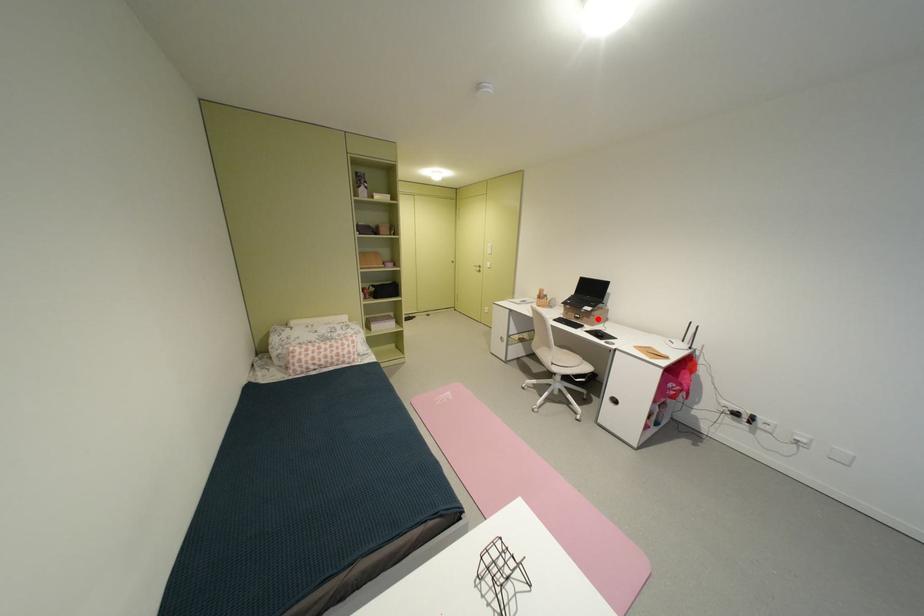
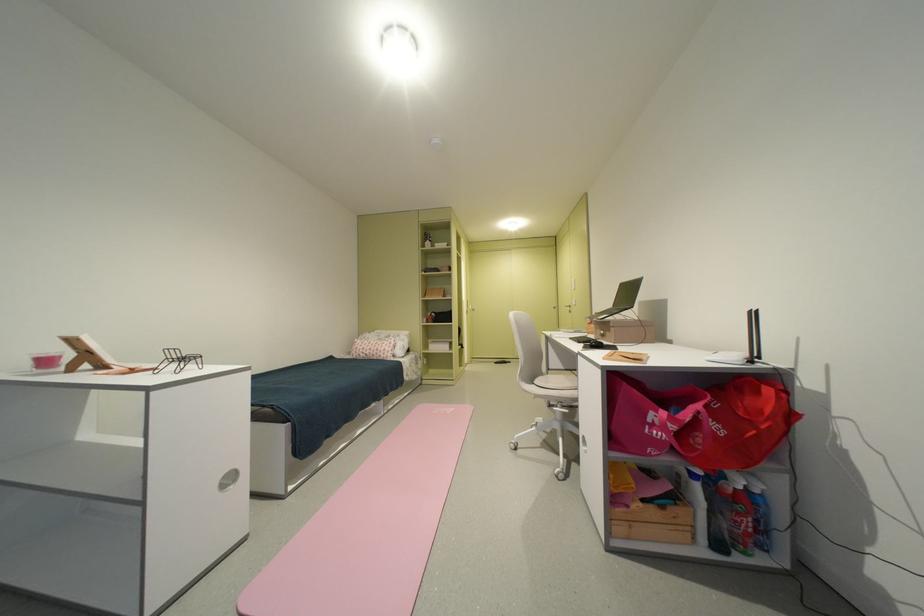
Where in the second image is the point corresponding to the highlighted location from the first image?

(618, 331)